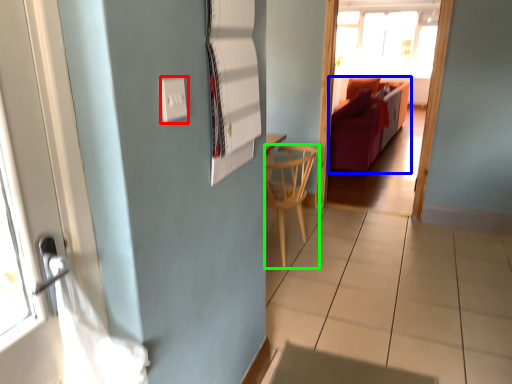
Question: Which object is positioned closest to electric outlet (highlighted by a red box)? Select from furniture (highlighted by a blue box) and chair (highlighted by a green box).

Choices:
 (A) furniture
 (B) chair

Answer: (B)